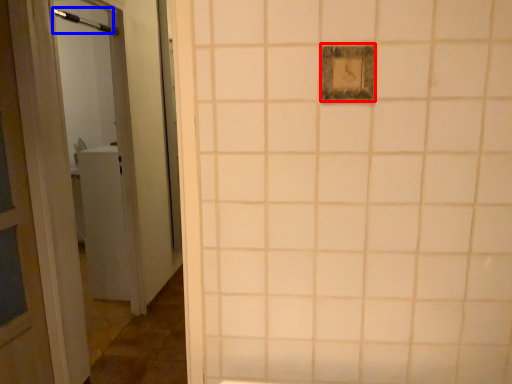
Question: Which point is further to the camera, light switch (highlighted by a red box) or shower (highlighted by a blue box)?

Choices:
 (A) light switch
 (B) shower

Answer: (B)